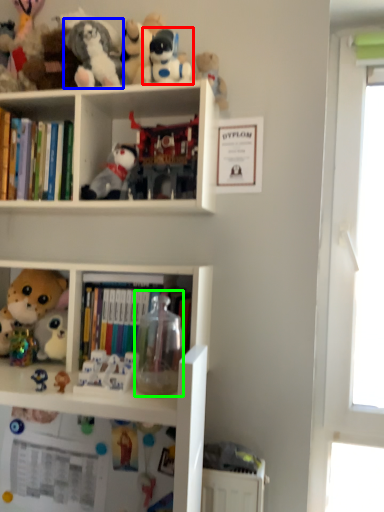
Question: Estimate the real-world distances between objects in this image. Which object is farther from toy (highlighted by a red box), toy (highlighted by a blue box) or toy (highlighted by a green box)?

Choices:
 (A) toy
 (B) toy

Answer: (B)